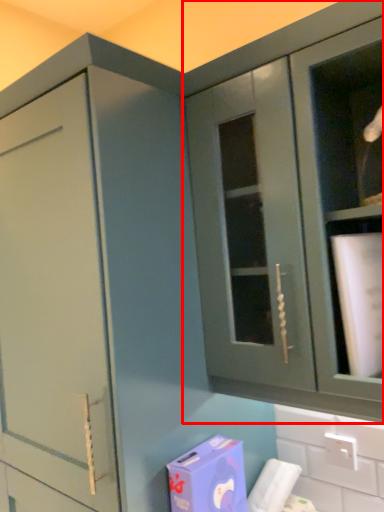
Question: Considering the relative positions of cabinetry (annotated by the red box) and cardboard box in the image provided, where is cabinetry (annotated by the red box) located with respect to the staircase?

Choices:
 (A) right
 (B) left

Answer: (A)